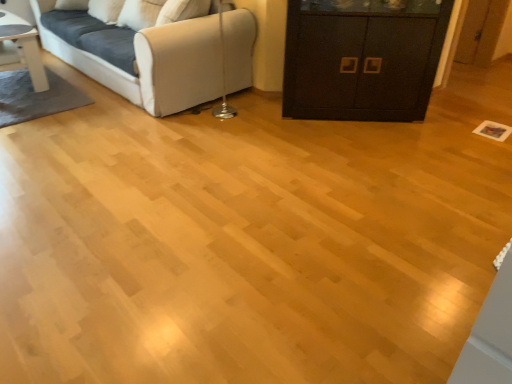
Question: Is white glossy table at upper left aimed at white fabric couch at upper left?

Choices:
 (A) no
 (B) yes

Answer: (A)

Question: Is white glossy table at upper left not near white fabric couch at upper left?

Choices:
 (A) yes
 (B) no

Answer: (B)

Question: Is the position of white glossy table at upper left more distant than that of white fabric couch at upper left?

Choices:
 (A) no
 (B) yes

Answer: (B)

Question: Would you say white fabric couch at upper left is part of white glossy table at upper left's contents?

Choices:
 (A) no
 (B) yes

Answer: (A)

Question: From the image's perspective, is white glossy table at upper left located beneath white fabric couch at upper left?

Choices:
 (A) yes
 (B) no

Answer: (A)

Question: Based on their sizes in the image, would you say white glossy table at upper left is bigger or smaller than black matte cabinet at center?

Choices:
 (A) small
 (B) big

Answer: (A)

Question: From the image's perspective, is white glossy table at upper left above or below black matte cabinet at center?

Choices:
 (A) below
 (B) above

Answer: (B)

Question: Is point (2, 13) positioned closer to the camera than point (429, 77)?

Choices:
 (A) closer
 (B) farther

Answer: (B)

Question: Considering the positions of white glossy table at upper left and black matte cabinet at center in the image, is white glossy table at upper left wider or thinner than black matte cabinet at center?

Choices:
 (A) wide
 (B) thin

Answer: (B)

Question: Considering the relative positions of black matte cabinet at center and white glossy table at upper left in the image provided, is black matte cabinet at center to the left or to the right of white glossy table at upper left?

Choices:
 (A) left
 (B) right

Answer: (B)

Question: From their relative heights in the image, would you say black matte cabinet at center is taller or shorter than white glossy table at upper left?

Choices:
 (A) tall
 (B) short

Answer: (A)

Question: From the image's perspective, is black matte cabinet at center positioned above or below white glossy table at upper left?

Choices:
 (A) below
 (B) above

Answer: (A)

Question: Would you say black matte cabinet at center is inside or outside white glossy table at upper left?

Choices:
 (A) outside
 (B) inside

Answer: (A)

Question: In terms of size, does white fabric couch at upper left appear bigger or smaller than white glossy table at upper left?

Choices:
 (A) small
 (B) big

Answer: (B)

Question: Considering the positions of white fabric couch at upper left and white glossy table at upper left in the image, is white fabric couch at upper left wider or thinner than white glossy table at upper left?

Choices:
 (A) thin
 (B) wide

Answer: (B)